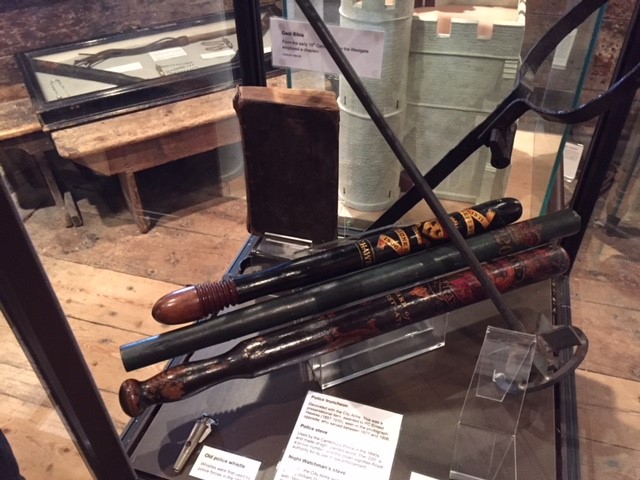
Identify the location of wood floor. Image resolution: width=640 pixels, height=480 pixels. (129, 294).